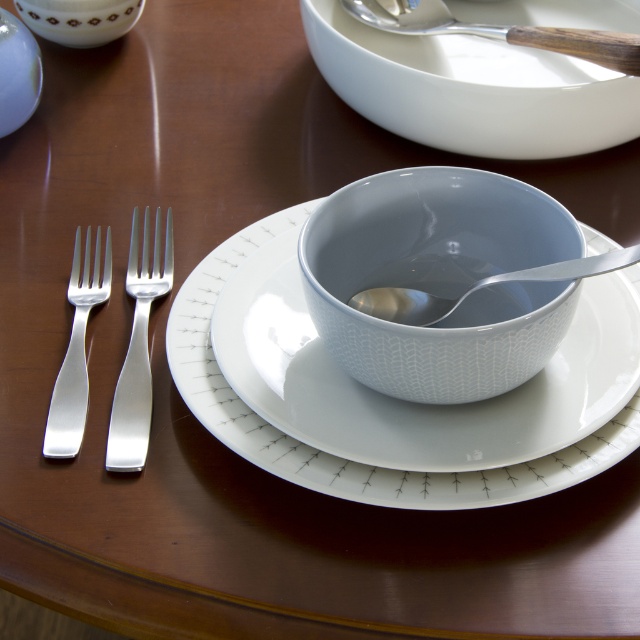
Can you confirm if silver metallic spoon at center is positioned below matte white bowl at upper left?

Correct, silver metallic spoon at center is located below matte white bowl at upper left.

How much distance is there between silver metallic spoon at center and matte white bowl at upper left?

They are 18.58 inches apart.

Locate an element on the screen. Image resolution: width=640 pixels, height=640 pixels. silver metallic spoon at center is located at coordinates (480, 289).

Where is `silver metallic spoon at center`? The width and height of the screenshot is (640, 640). silver metallic spoon at center is located at coordinates (480, 289).

Can you confirm if white glossy bowl at center is smaller than wooden-handled spoon at upper center?

Indeed, white glossy bowl at center has a smaller size compared to wooden-handled spoon at upper center.

Does white glossy bowl at center appear under wooden-handled spoon at upper center?

Correct, white glossy bowl at center is located below wooden-handled spoon at upper center.

Is point (449, 168) farther from camera compared to point (420, 10)?

No, it is in front of (420, 10).

Find the location of a particular element. The image size is (640, 640). white glossy bowl at center is located at coordinates point(440,280).

Who is more forward, (x=131, y=397) or (x=588, y=262)?

Positioned in front is point (x=588, y=262).

Find the location of a particular element. The width and height of the screenshot is (640, 640). polished silver fork at left is located at coordinates (138, 348).